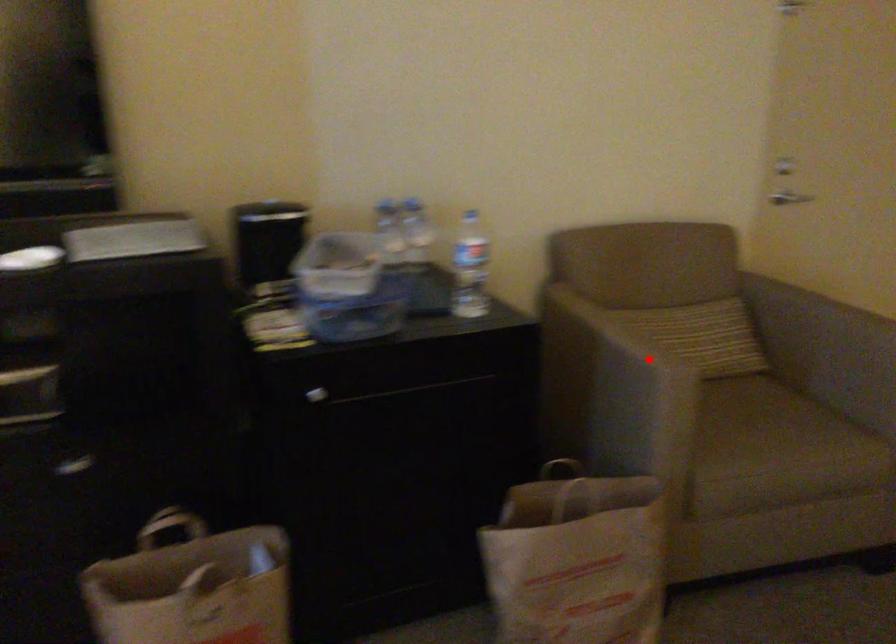
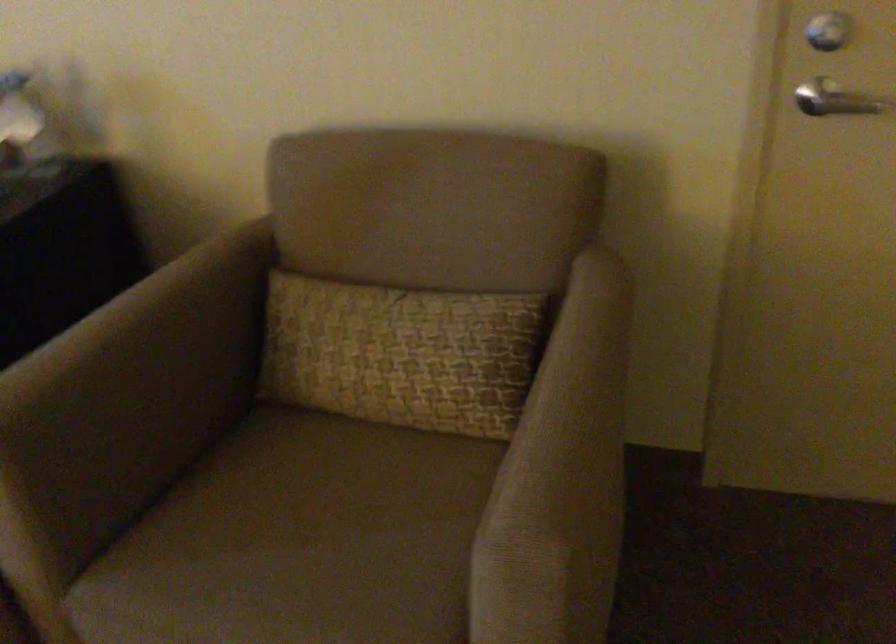
Question: I am providing you with two images of the same scene from different viewpoints. Given a red point in image1, look at the same physical point in image2. Is it:

Choices:
 (A) Closer to the viewpoint
 (B) Farther from the viewpoint

Answer: (A)